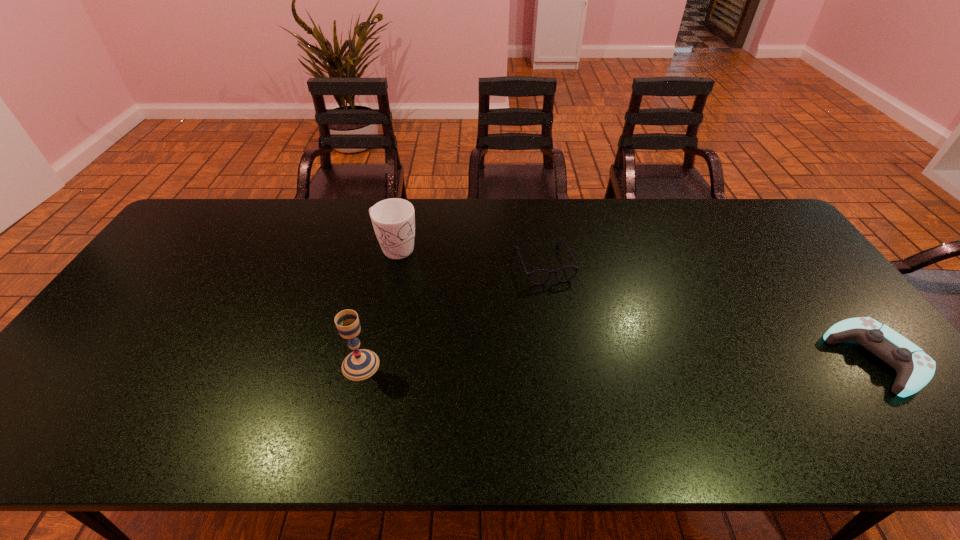
Locate an element on the screen. Image resolution: width=960 pixels, height=540 pixels. vacant area located 0.210m on the side of the mug with the handle is located at coordinates pos(461,289).

I want to click on vacant space located on the side of the mug with the handle, so click(498, 313).

Where is `object located at the far edge`? This screenshot has height=540, width=960. object located at the far edge is located at coordinates (393, 220).

Find the location of `chalice that is at the near edge`. chalice that is at the near edge is located at coordinates (361, 364).

I want to click on control that is at the near edge, so click(915, 368).

This screenshot has width=960, height=540. I want to click on object that is at the right edge, so click(915, 368).

What are the coordinates of `object present at the near right corner` in the screenshot? It's located at (915, 368).

Find the location of a particular element. This screenshot has width=960, height=540. vacant area at the far edge of the desktop is located at coordinates (462, 211).

Where is `free spot at the near edge of the desktop`? free spot at the near edge of the desktop is located at coordinates (751, 383).

Locate an element on the screen. vacant space at the left edge of the desktop is located at coordinates (190, 271).